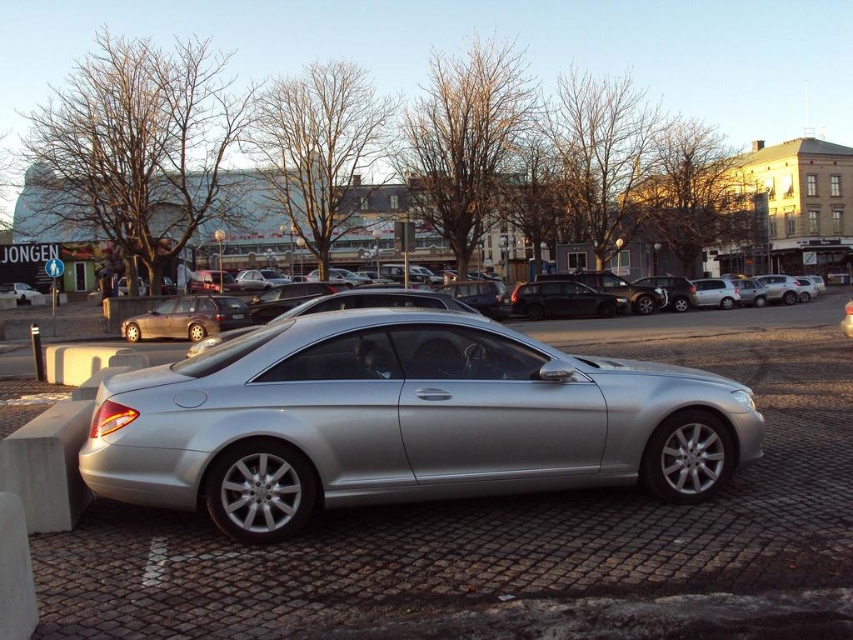
Question: Does shiny black sedan at center come in front of matte black car at left?

Choices:
 (A) no
 (B) yes

Answer: (B)

Question: Is silver metallic car at center below matte brown sedan at center?

Choices:
 (A) yes
 (B) no

Answer: (A)

Question: Estimate the real-world distances between objects in this image. Which object is closer to the black plastic license plate at center?

Choices:
 (A) matte brown sedan at center
 (B) matte black car at left
 (C) silver metallic car at center
 (D) shiny black sedan at center

Answer: (A)

Question: From the image, what is the correct spatial relationship of shiny black sedan at center in relation to black plastic license plate at center?

Choices:
 (A) right
 (B) left

Answer: (A)

Question: Estimate the real-world distances between objects in this image. Which object is farther from the shiny black sedan at center?

Choices:
 (A) silver metallic car at center
 (B) matte black car at left

Answer: (B)

Question: Based on their relative distances, which object is farther from the silver metallic car at center?

Choices:
 (A) matte black car at left
 (B) shiny black sedan at center
 (C) matte brown sedan at center

Answer: (A)